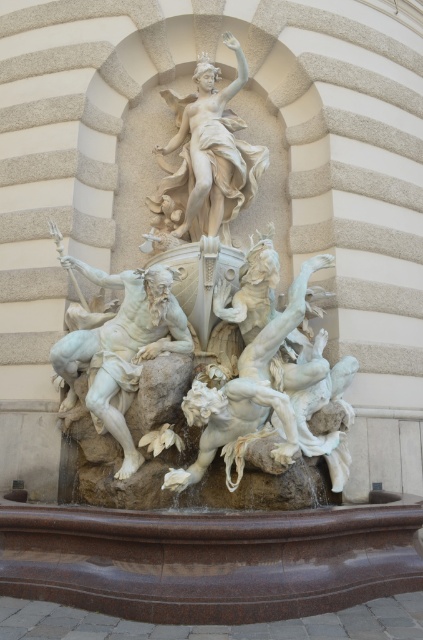
In the scene shown: Which is below, white marble statue at center or white marble statue at upper center?

white marble statue at center

From the picture: Who is positioned more to the left, white marble statue at center or white marble statue at upper center?

white marble statue at upper center is more to the left.

What are the coordinates of `white marble statue at center` in the screenshot? It's located at (266, 378).

Identify the location of white marble statue at center. tap(266, 378).

Between white marble statue at upper center and white marble figure at center, which one is positioned higher?

Positioned higher is white marble statue at upper center.

In the scene shown: Who is positioned more to the right, white marble statue at upper center or white marble figure at center?

white marble statue at upper center is more to the right.

Measure the distance between white marble statue at upper center and camera.

They are 51.44 meters apart.

The image size is (423, 640). In order to click on white marble statue at upper center in this screenshot , I will do `click(208, 157)`.

Is white marble statue at center wider than white marble figure at center?

Yes, white marble statue at center is wider than white marble figure at center.

In the scene shown: Is white marble statue at center further to camera compared to white marble figure at center?

No, it is in front of white marble figure at center.

The height and width of the screenshot is (640, 423). I want to click on white marble statue at center, so click(x=266, y=378).